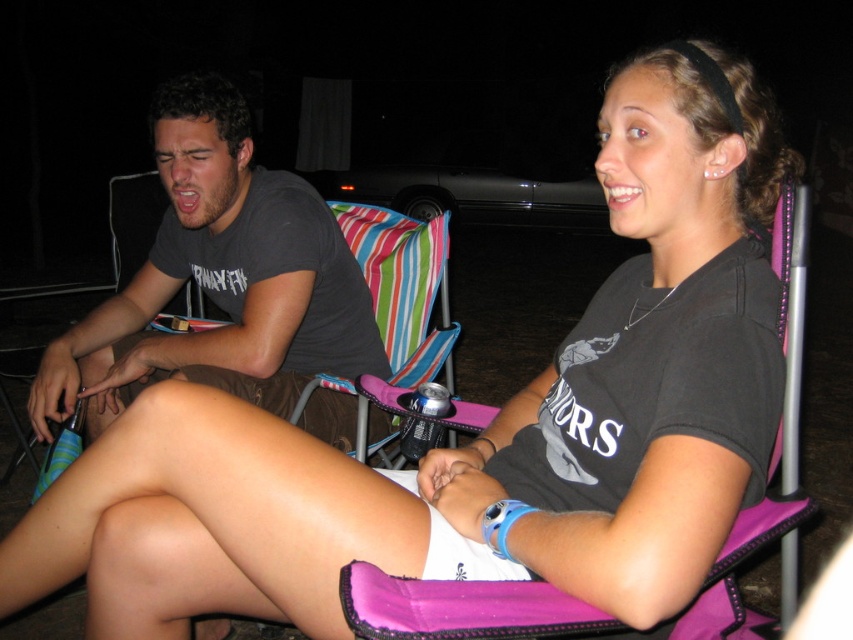
Question: Does dark gray t-shirt at left have a smaller size compared to purple fabric beach chair at right?

Choices:
 (A) yes
 (B) no

Answer: (B)

Question: Is dark gray t-shirt at left to the right of purple fabric beach chair at right from the viewer's perspective?

Choices:
 (A) no
 (B) yes

Answer: (A)

Question: Does dark gray t-shirt at left have a smaller size compared to purple fabric beach chair at right?

Choices:
 (A) no
 (B) yes

Answer: (A)